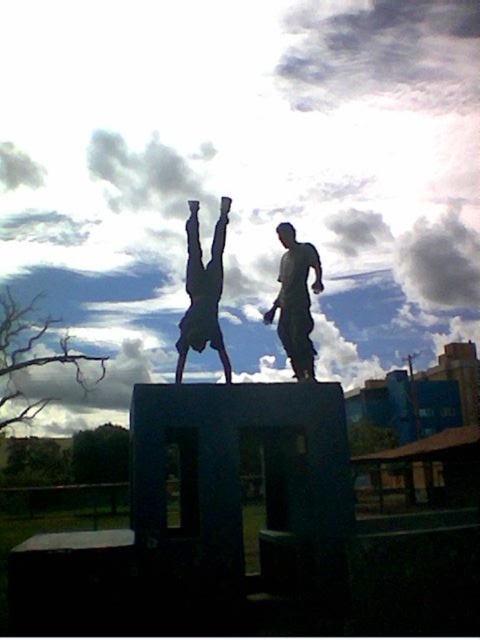
From the picture: Can you confirm if metallic silver statue at center is taller than matte gray statue at center?

Indeed, metallic silver statue at center has a greater height compared to matte gray statue at center.

Measure the distance between metallic silver statue at center and camera.

metallic silver statue at center and camera are 8.22 meters apart from each other.

Measure the distance between metallic silver statue at center and camera.

metallic silver statue at center and camera are 8.22 meters apart.

Where is `metallic silver statue at center`? metallic silver statue at center is located at coordinates (203, 291).